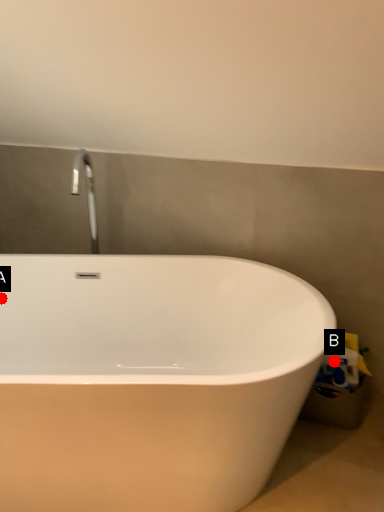
Question: Two points are circled on the image, labeled by A and B beside each circle. Which of the following is the closest to the observer?

Choices:
 (A) A is closer
 (B) B is closer

Answer: (B)